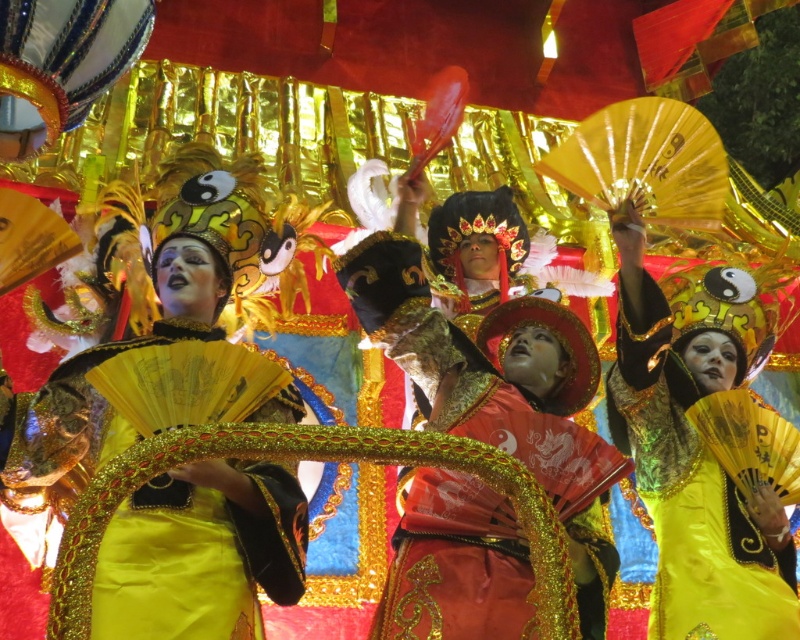
Question: Is shiny gold fabric at center thinner than shiny yellow fabric at center?

Choices:
 (A) yes
 (B) no

Answer: (B)

Question: Is shiny gold fabric at center smaller than shiny red fabric at center?

Choices:
 (A) yes
 (B) no

Answer: (B)

Question: Which point is farther to the camera?

Choices:
 (A) shiny yellow fabric at center
 (B) shiny gold fabric at center
 (C) shiny red fabric at center

Answer: (A)

Question: Is shiny gold fabric at center to the right of shiny yellow fabric at center from the viewer's perspective?

Choices:
 (A) no
 (B) yes

Answer: (A)

Question: Estimate the real-world distances between objects in this image. Which object is closer to the shiny red fabric at center?

Choices:
 (A) shiny yellow fabric at center
 (B) shiny gold fabric at center

Answer: (B)

Question: Which object is closer to the camera taking this photo?

Choices:
 (A) shiny yellow fabric at center
 (B) shiny red fabric at center

Answer: (B)